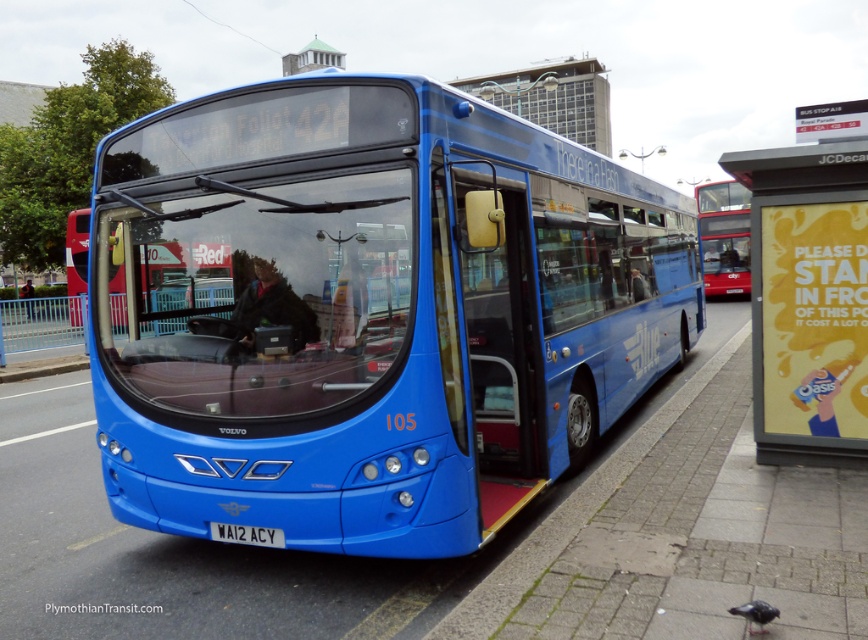
The width and height of the screenshot is (868, 640). What do you see at coordinates (369, 310) in the screenshot? I see `blue metallic bus at center` at bounding box center [369, 310].

Does blue metallic bus at center have a smaller size compared to yellow paper poster at right?

No, blue metallic bus at center is not smaller than yellow paper poster at right.

Describe the element at coordinates (369, 310) in the screenshot. The image size is (868, 640). I see `blue metallic bus at center` at that location.

This screenshot has height=640, width=868. I want to click on blue metallic bus at center, so (x=369, y=310).

Is blue metallic bus at center closer to camera compared to white matte license plate at center?

No.

Who is higher up, blue metallic bus at center or white matte license plate at center?

blue metallic bus at center is above.

Who is more distant from viewer, (490, 252) or (266, 544)?

The point (490, 252) is more distant.

Where is `blue metallic bus at center`? The image size is (868, 640). blue metallic bus at center is located at coordinates (369, 310).

Who is lower down, smooth concrete pavement at center or dark blue jacket at center?

smooth concrete pavement at center is lower down.

Find the location of `smooth concrete pavement at center`. smooth concrete pavement at center is located at coordinates (220, 544).

The image size is (868, 640). I want to click on smooth concrete pavement at center, so click(x=220, y=544).